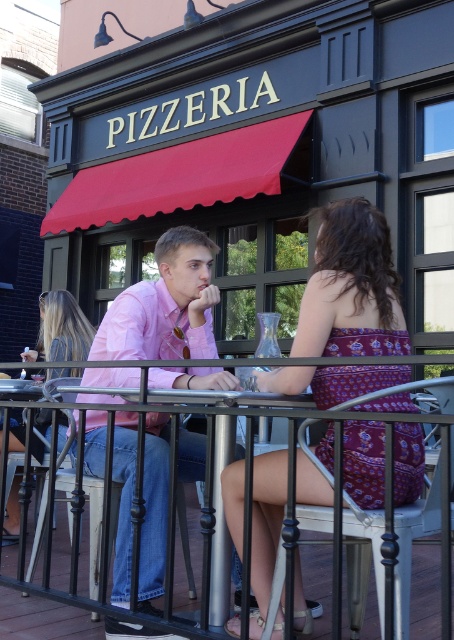
Can you confirm if printed fabric dress at center is positioned above blonde hair at center?

Incorrect, printed fabric dress at center is not positioned above blonde hair at center.

Is point (420, 449) farther from viewer compared to point (53, 332)?

No, (420, 449) is closer to viewer.

Does point (265, 540) come farther from viewer compared to point (63, 339)?

No, it is in front of (63, 339).

Locate an element on the screen. Image resolution: width=454 pixels, height=640 pixels. printed fabric dress at center is located at coordinates (351, 288).

Consider the image. Is blonde hair at center taller than black metal railing at center?

No, blonde hair at center is not taller than black metal railing at center.

Find the location of a particular element. The width and height of the screenshot is (454, 640). blonde hair at center is located at coordinates (60, 330).

Is printed fabric dress at center shorter than pink cotton shirt at center?

No, printed fabric dress at center is not shorter than pink cotton shirt at center.

Can you confirm if printed fabric dress at center is smaller than pink cotton shirt at center?

Correct, printed fabric dress at center occupies less space than pink cotton shirt at center.

Who is more forward, [329,504] or [192,387]?

Point [329,504]

Where is `printed fabric dress at center`? The height and width of the screenshot is (640, 454). printed fabric dress at center is located at coordinates (351, 288).